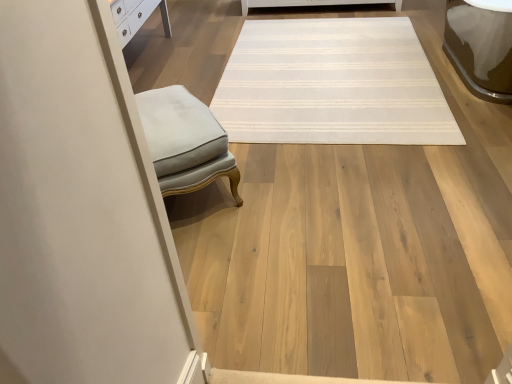
This screenshot has width=512, height=384. What are the coordinates of `vacant area that lies in front of light gray fabric ottoman at left` in the screenshot? It's located at (229, 245).